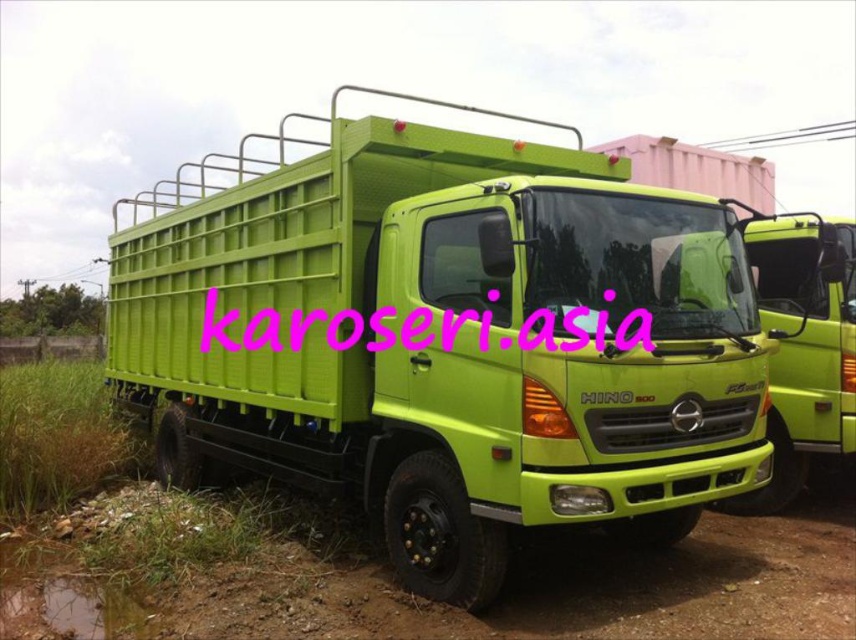
Question: Is lime green plastic truck at center further to the viewer compared to green matte dirt track at lower left?

Choices:
 (A) no
 (B) yes

Answer: (A)

Question: Which point is farther to the camera?

Choices:
 (A) green matte dirt track at lower left
 (B) lime green plastic truck at center

Answer: (A)

Question: Does lime green plastic truck at center appear on the left side of green matte dirt track at lower left?

Choices:
 (A) no
 (B) yes

Answer: (A)

Question: Where is lime green plastic truck at center located in relation to green matte dirt track at lower left in the image?

Choices:
 (A) left
 (B) right

Answer: (B)

Question: Which point appears farthest from the camera in this image?

Choices:
 (A) (592, 636)
 (B) (179, 344)

Answer: (B)